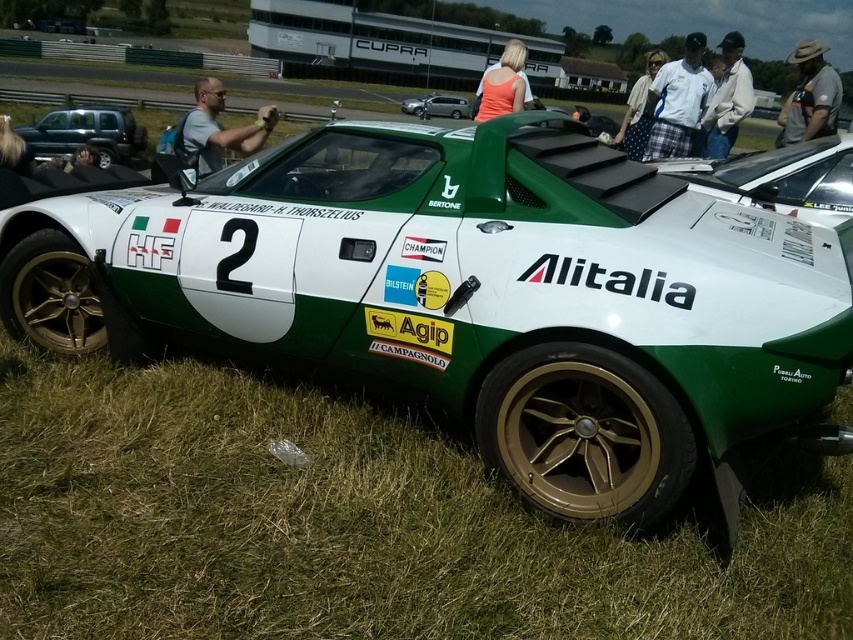
You are a photographer at the event and want to capture both the green grass at lower left and the plaid fabric shirt at upper center in your photo. Which object will appear closer to the bottom of the frame?

The green grass at lower left will appear closer to the bottom of the frame because it is shorter than the plaid fabric shirt at upper center.

What object is located at the coordinate point [437,106] in the image?

The point [437,106] corresponds to the metallic silver sedan at center.

You are a photographer at the motorsport event and want to capture a photo that includes both the green grass at lower left and the plaid fabric shirt at upper center. Which object should you focus on first to ensure both are in frame?

You should focus on the plaid fabric shirt at upper center first because the green grass at lower left is below it, so adjusting the camera angle to include the upper object will naturally include the lower one as well.